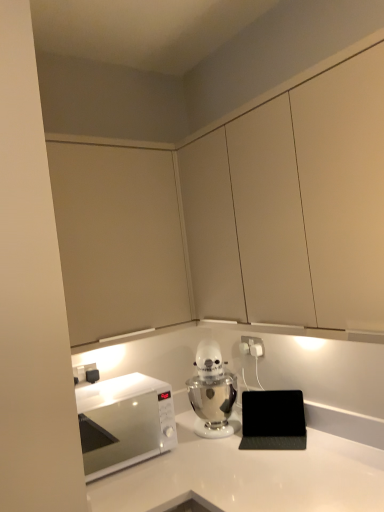
This screenshot has height=512, width=384. What do you see at coordinates (212, 392) in the screenshot?
I see `metallic silver stand mixer at center` at bounding box center [212, 392].

Where is `matte beige cabinet at upper left, marked as the second cabinetry in a right-to-left arrangement`? The height and width of the screenshot is (512, 384). matte beige cabinet at upper left, marked as the second cabinetry in a right-to-left arrangement is located at coordinates (118, 239).

Considering the sizes of objects white glossy countertop at center and matte white cabinets at upper center, positioned as the second cabinetry in left-to-right order, in the image provided, who is bigger, white glossy countertop at center or matte white cabinets at upper center, positioned as the second cabinetry in left-to-right order,?

white glossy countertop at center is bigger.

Is matte white cabinets at upper center, which appears as the first cabinetry when viewed from the right, located within white glossy countertop at center?

No, matte white cabinets at upper center, which appears as the first cabinetry when viewed from the right, is located outside of white glossy countertop at center.

Is white glossy countertop at center oriented towards matte white cabinets at upper center, positioned as the second cabinetry in left-to-right order?

No, white glossy countertop at center is not aimed at matte white cabinets at upper center, positioned as the second cabinetry in left-to-right order.

How many degrees apart are the facing directions of white glossy countertop at center and matte white cabinets at upper center, positioned as the second cabinetry in left-to-right order?

The angle between the facing direction of white glossy countertop at center and the facing direction of matte white cabinets at upper center, positioned as the second cabinetry in left-to-right order, is 0.737 degrees.

Is white glossy microwave at left inside the boundaries of white glossy countertop at center, or outside?

white glossy microwave at left exists outside the volume of white glossy countertop at center.

Is white glossy microwave at left behind white glossy countertop at center?

Yes, the depth of white glossy microwave at left is greater than that of white glossy countertop at center.

Is white glossy microwave at left shorter than white glossy countertop at center?

Correct, white glossy microwave at left is not as tall as white glossy countertop at center.

Looking at this image, from the image's perspective, is matte white cabinets at upper center, which appears as the first cabinetry when viewed from the right, located above white glossy countertop at center?

Yes, from the image's perspective, matte white cabinets at upper center, which appears as the first cabinetry when viewed from the right, is above white glossy countertop at center.

Is point (198, 165) closer to viewer compared to point (327, 495)?

No, it is not.

Is matte white cabinets at upper center, which appears as the first cabinetry when viewed from the right, placed right next to white glossy countertop at center?

matte white cabinets at upper center, which appears as the first cabinetry when viewed from the right, and white glossy countertop at center are not in contact.

Who is smaller, metallic silver stand mixer at center or white glossy countertop at center?

Smaller between the two is metallic silver stand mixer at center.

Is white glossy countertop at center completely or partially inside metallic silver stand mixer at center?

That's incorrect, white glossy countertop at center is not inside metallic silver stand mixer at center.

Is point (205, 348) behind point (212, 477)?

That is True.

Between white plastic electric outlet at center-right and white glossy microwave at left, which one appears on the left side from the viewer's perspective?

white glossy microwave at left is more to the left.

How different are the orientations of white plastic electric outlet at center-right and white glossy microwave at left in degrees?

88.4 degrees separate the facing orientations of white plastic electric outlet at center-right and white glossy microwave at left.

Is white glossy microwave at left at the back of white plastic electric outlet at center-right?

That's not correct — white plastic electric outlet at center-right is not looking away from white glossy microwave at left.

Between point (246, 346) and point (112, 409), which one is positioned behind?

The point (246, 346) is behind.

From the image's perspective, is white glossy microwave at left located beneath matte beige cabinet at upper left, marked as the second cabinetry in a right-to-left arrangement?

Yes.

The height and width of the screenshot is (512, 384). Find the location of `cabinetry that is the 1st one when counting upward from the white glossy microwave at left (from the image's perspective)`. cabinetry that is the 1st one when counting upward from the white glossy microwave at left (from the image's perspective) is located at coordinates (118, 239).

Does white glossy microwave at left have a lesser width compared to matte beige cabinet at upper left, marked as the second cabinetry in a right-to-left arrangement?

No, white glossy microwave at left is not thinner than matte beige cabinet at upper left, marked as the second cabinetry in a right-to-left arrangement.

Are white glossy microwave at left and matte beige cabinet at upper left, the first cabinetry from the left, far apart?

white glossy microwave at left is near matte beige cabinet at upper left, the first cabinetry from the left, not far away.

Is white glossy countertop at center spatially inside matte beige cabinet at upper left, marked as the second cabinetry in a right-to-left arrangement, or outside of it?

white glossy countertop at center is located beyond the bounds of matte beige cabinet at upper left, marked as the second cabinetry in a right-to-left arrangement.

From the image's perspective, is white glossy countertop at center located above matte beige cabinet at upper left, the first cabinetry from the left?

No, from the image's perspective, white glossy countertop at center is not above matte beige cabinet at upper left, the first cabinetry from the left.

Does white glossy countertop at center have a lesser width compared to matte beige cabinet at upper left, marked as the second cabinetry in a right-to-left arrangement?

No, white glossy countertop at center is not thinner than matte beige cabinet at upper left, marked as the second cabinetry in a right-to-left arrangement.

In the scene shown: Can you confirm if white glossy countertop at center is positioned to the right of matte beige cabinet at upper left, marked as the second cabinetry in a right-to-left arrangement?

Indeed, white glossy countertop at center is positioned on the right side of matte beige cabinet at upper left, marked as the second cabinetry in a right-to-left arrangement.

Image resolution: width=384 pixels, height=512 pixels. Identify the location of countertop in front of the matte white cabinets at upper center, which appears as the first cabinetry when viewed from the right. (250, 476).

The image size is (384, 512). What are the coordinates of `countertop below the white glossy microwave at left (from the image's perspective)` in the screenshot? It's located at (250, 476).

Looking at the image, which one is located closer to matte white cabinets at upper center, positioned as the second cabinetry in left-to-right order, matte beige cabinet at upper left, marked as the second cabinetry in a right-to-left arrangement, or metallic silver stand mixer at center?

matte beige cabinet at upper left, marked as the second cabinetry in a right-to-left arrangement, is closer to matte white cabinets at upper center, positioned as the second cabinetry in left-to-right order.

Looking at the image, which one is located closer to white glossy microwave at left, metallic silver stand mixer at center or matte white cabinets at upper center, which appears as the first cabinetry when viewed from the right?

Based on the image, metallic silver stand mixer at center appears to be nearer to white glossy microwave at left.

Consider the image. When comparing their distances from matte white cabinets at upper center, positioned as the second cabinetry in left-to-right order, does white glossy countertop at center or white plastic electric outlet at center-right seem further?

The object further to matte white cabinets at upper center, positioned as the second cabinetry in left-to-right order, is white plastic electric outlet at center-right.

Looking at the image, which one is located closer to matte beige cabinet at upper left, marked as the second cabinetry in a right-to-left arrangement, white plastic electric outlet at center-right or white glossy microwave at left?

white glossy microwave at left is positioned closer to the anchor matte beige cabinet at upper left, marked as the second cabinetry in a right-to-left arrangement.

Estimate the real-world distances between objects in this image. Which object is closer to white glossy microwave at left, white plastic electric outlet at center-right or matte beige cabinet at upper left, marked as the second cabinetry in a right-to-left arrangement?

matte beige cabinet at upper left, marked as the second cabinetry in a right-to-left arrangement.

Based on the photo, considering their positions, is white glossy microwave at left positioned closer to matte beige cabinet at upper left, marked as the second cabinetry in a right-to-left arrangement, than white plastic electric outlet at center-right?

Among the two, white glossy microwave at left is located nearer to matte beige cabinet at upper left, marked as the second cabinetry in a right-to-left arrangement.

Estimate the real-world distances between objects in this image. Which object is further from white plastic electric outlet at center-right, metallic silver stand mixer at center or matte white cabinets at upper center, which appears as the first cabinetry when viewed from the right?

matte white cabinets at upper center, which appears as the first cabinetry when viewed from the right, is further to white plastic electric outlet at center-right.

Based on their spatial positions, is matte white cabinets at upper center, positioned as the second cabinetry in left-to-right order, or white glossy microwave at left closer to metallic silver stand mixer at center?

white glossy microwave at left lies closer to metallic silver stand mixer at center than the other object.

Find the location of a particular element. This screenshot has width=384, height=512. home appliance between matte beige cabinet at upper left, marked as the second cabinetry in a right-to-left arrangement, and white glossy microwave at left in the up-down direction is located at coordinates click(212, 392).

Find the location of `home appliance between matte beige cabinet at upper left, the first cabinetry from the left, and white glossy countertop at center from top to bottom`. home appliance between matte beige cabinet at upper left, the first cabinetry from the left, and white glossy countertop at center from top to bottom is located at coordinates (212, 392).

Locate an element on the screen. cabinetry between matte white cabinets at upper center, which appears as the first cabinetry when viewed from the right, and white glossy microwave at left, in the vertical direction is located at coordinates (118, 239).

Where is `cabinetry between matte white cabinets at upper center, positioned as the second cabinetry in left-to-right order, and white glossy countertop at center in the up-down direction`? This screenshot has height=512, width=384. cabinetry between matte white cabinets at upper center, positioned as the second cabinetry in left-to-right order, and white glossy countertop at center in the up-down direction is located at coordinates (118, 239).